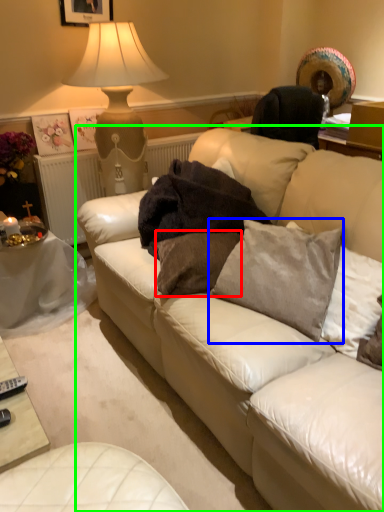
Question: Which is farther away from pillow (highlighted by a red box)? pillow (highlighted by a blue box) or studio couch (highlighted by a green box)?

Choices:
 (A) pillow
 (B) studio couch

Answer: (B)